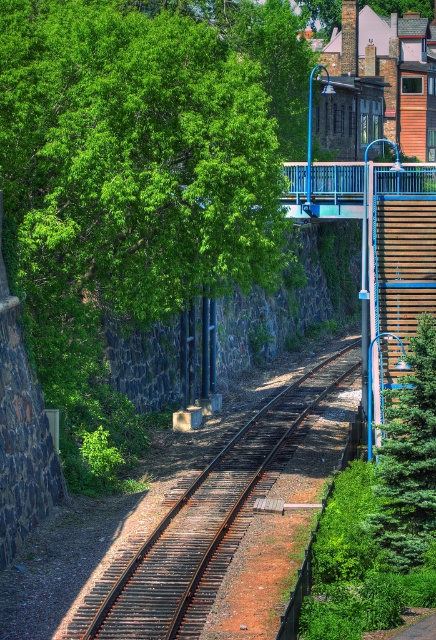
Is green leafy tree at upper left taller than rusty metal train track at center?

Yes.

Who is higher up, green leafy tree at upper left or rusty metal train track at center?

green leafy tree at upper left

Describe the element at coordinates (133, 157) in the screenshot. I see `green leafy tree at upper left` at that location.

Locate an element on the screen. green leafy tree at upper left is located at coordinates (133, 157).

Can you confirm if rusty metal train track at center is smaller than green textured evergreen at right?

Incorrect, rusty metal train track at center is not smaller in size than green textured evergreen at right.

Who is positioned more to the left, rusty metal train track at center or green textured evergreen at right?

rusty metal train track at center is more to the left.

Who is more forward, (214, 579) or (431, 440)?

Positioned in front is point (214, 579).

Where is `rusty metal train track at center`? This screenshot has width=436, height=640. rusty metal train track at center is located at coordinates (204, 522).

Looking at this image, measure the distance between green leafy tree at upper left and green textured evergreen at right.

A distance of 10.18 meters exists between green leafy tree at upper left and green textured evergreen at right.

Who is shorter, green leafy tree at upper left or green textured evergreen at right?

Standing shorter between the two is green textured evergreen at right.

Is point (115, 282) positioned in front of point (415, 362)?

No.

The width and height of the screenshot is (436, 640). Identify the location of green leafy tree at upper left. (133, 157).